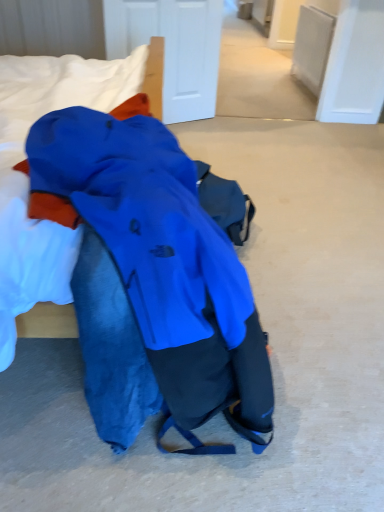
What do you see at coordinates (28, 182) in the screenshot? This screenshot has height=512, width=384. I see `blue fabric at upper left` at bounding box center [28, 182].

Where is `blue fabric at upper left`? blue fabric at upper left is located at coordinates (28, 182).

Describe the element at coordinates (152, 278) in the screenshot. I see `matte blue jacket at center` at that location.

You are a GUI agent. You are given a task and a screenshot of the screen. Output one action in this format:
    pyautogui.click(x=<x>, y=<y>)
    Task: Click on the matte blue jacket at center
    The width and height of the screenshot is (384, 512).
    Given the screenshot: What is the action you would take?
    pyautogui.click(x=152, y=278)

You are a GUI agent. You are given a task and a screenshot of the screen. Output one action in this format:
    pyautogui.click(x=<x>, y=<y>)
    Task: Click on the blue fabric at upper left
    The width and height of the screenshot is (384, 512).
    Given the screenshot: What is the action you would take?
    pyautogui.click(x=28, y=182)

Does blue fabric at upper left appear on the left side of matte blue jacket at center?

Yes, blue fabric at upper left is to the left of matte blue jacket at center.

In the image, is blue fabric at upper left positioned in front of or behind matte blue jacket at center?

blue fabric at upper left is behind matte blue jacket at center.

Is point (109, 106) positioned behind point (121, 271)?

Yes, point (109, 106) is farther from viewer.

From the image's perspective, between blue fabric at upper left and matte blue jacket at center, which one is located above?

From the image's view, blue fabric at upper left is above.

From a real-world perspective, is blue fabric at upper left under matte blue jacket at center?

Actually, blue fabric at upper left is physically above matte blue jacket at center in the real world.

In terms of width, does blue fabric at upper left look wider or thinner when compared to matte blue jacket at center?

In the image, blue fabric at upper left appears to be more narrow than matte blue jacket at center.

Is blue fabric at upper left taller than matte blue jacket at center?

Incorrect, the height of blue fabric at upper left is not larger of that of matte blue jacket at center.

Considering the sizes of objects blue fabric at upper left and matte blue jacket at center in the image provided, who is bigger, blue fabric at upper left or matte blue jacket at center?

matte blue jacket at center is bigger.

Is blue fabric at upper left located outside matte blue jacket at center?

No, blue fabric at upper left is inside matte blue jacket at center's boundary.

Would you say blue fabric at upper left is a long distance from matte blue jacket at center?

No, there isn't a large distance between blue fabric at upper left and matte blue jacket at center.

Could you tell me if blue fabric at upper left is turned towards matte blue jacket at center?

Yes.

Based on the photo, can you tell me how much blue fabric at upper left and matte blue jacket at center differ in facing direction?

blue fabric at upper left and matte blue jacket at center are facing 13.3 degrees away from each other.

Find the location of a particular element. bed behind the matte blue jacket at center is located at coordinates (28, 182).

Based on their positions, is matte blue jacket at center located to the left or right of blue fabric at upper left?

From the image, it's evident that matte blue jacket at center is to the right of blue fabric at upper left.

Is matte blue jacket at center closer to camera compared to blue fabric at upper left?

Yes, it is in front of blue fabric at upper left.

Does point (191, 303) come behind point (28, 89)?

No, it is in front of (28, 89).

From the image's perspective, is matte blue jacket at center located above blue fabric at upper left?

No, from the image's perspective, matte blue jacket at center is not on top of blue fabric at upper left.

Based on the photo, from a real-world perspective, is matte blue jacket at center on blue fabric at upper left?

Actually, matte blue jacket at center is physically below blue fabric at upper left in the real world.

Considering the sizes of objects matte blue jacket at center and blue fabric at upper left in the image provided, who is wider, matte blue jacket at center or blue fabric at upper left?

With larger width is matte blue jacket at center.

Is matte blue jacket at center taller than blue fabric at upper left?

Correct, matte blue jacket at center is much taller as blue fabric at upper left.

Considering the relative sizes of matte blue jacket at center and blue fabric at upper left in the image provided, is matte blue jacket at center smaller than blue fabric at upper left?

No, matte blue jacket at center is not smaller than blue fabric at upper left.

Is matte blue jacket at center inside the boundaries of blue fabric at upper left, or outside?

matte blue jacket at center is not inside blue fabric at upper left, it's outside.

Are matte blue jacket at center and blue fabric at upper left located far from each other?

No, matte blue jacket at center is in close proximity to blue fabric at upper left.

Is blue fabric at upper left at the back of matte blue jacket at center?

Yes, matte blue jacket at center's orientation is away from blue fabric at upper left.

How many degrees apart are the facing directions of matte blue jacket at center and blue fabric at upper left?

matte blue jacket at center and blue fabric at upper left are facing 13.3 degrees away from each other.

In the scene shown: How much distance is there between matte blue jacket at center and blue fabric at upper left?

matte blue jacket at center and blue fabric at upper left are 13.76 inches apart.

This screenshot has height=512, width=384. I want to click on bed that is above the matte blue jacket at center (from a real-world perspective), so click(28, 182).

You are a GUI agent. You are given a task and a screenshot of the screen. Output one action in this format:
    pyautogui.click(x=<x>, y=<y>)
    Task: Click on the jacket located underneath the blue fabric at upper left (from a real-world perspective)
    The height and width of the screenshot is (512, 384).
    Given the screenshot: What is the action you would take?
    pyautogui.click(x=152, y=278)

I want to click on bed on the left of the matte blue jacket at center, so (28, 182).